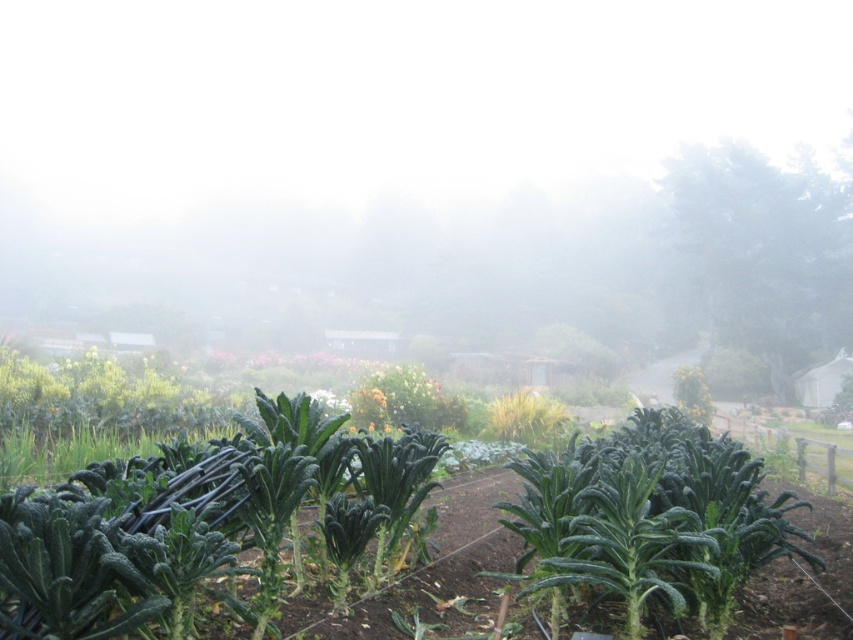
You are a landscape architect planning to install a new pathway between the white misty fog at upper center and the green leafy vegetables at center. Given that the pathway must be at least 60 meters long to accommodate all planned features, will the available space between these two elements suffice?

The distance between the white misty fog at upper center and the green leafy vegetables at center is 61.30 meters, which exceeds the required 60 meters. Therefore, the available space is sufficient to accommodate the pathway with the planned features.

You are a gardener standing in the garden bed with the green leafy vegetables at center. You want to walk towards the white misty fog at upper center. Is the fog closer to you or farther away?

The white misty fog at upper center is further to the viewer than the green leafy vegetables at center, so the fog is farther away from you.